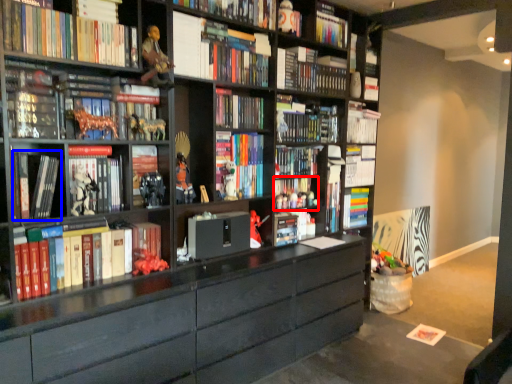
Question: Among these objects, which one is nearest to the camera, book (highlighted by a red box) or book (highlighted by a blue box)?

Choices:
 (A) book
 (B) book

Answer: (B)